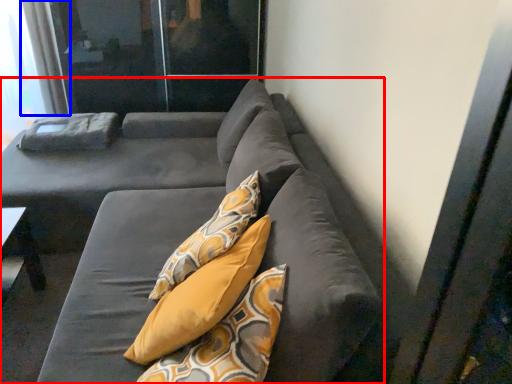
Question: Which object appears closest to the camera in this image, studio couch (highlighted by a red box) or curtain (highlighted by a blue box)?

Choices:
 (A) studio couch
 (B) curtain

Answer: (A)